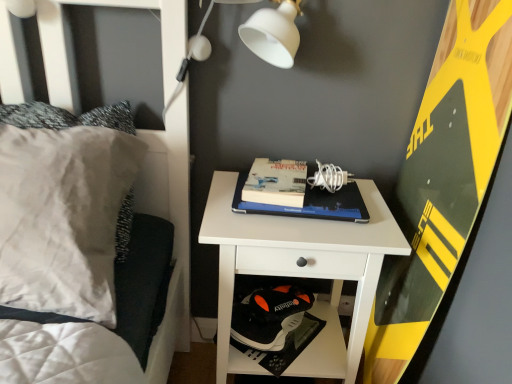
Question: Does hardcover book at center, which is counted as the 2th paperback book, starting from the left, come in front of yellow-green textured board at right?

Choices:
 (A) no
 (B) yes

Answer: (A)

Question: Does hardcover book at center, which is counted as the 2th paperback book, starting from the left, have a smaller size compared to yellow-green textured board at right?

Choices:
 (A) no
 (B) yes

Answer: (B)

Question: Can you confirm if hardcover book at center, which is counted as the 2th paperback book, starting from the left, is bigger than yellow-green textured board at right?

Choices:
 (A) yes
 (B) no

Answer: (B)

Question: From a real-world perspective, is hardcover book at center, which is counted as the 2th paperback book, starting from the left, below yellow-green textured board at right?

Choices:
 (A) yes
 (B) no

Answer: (B)

Question: Does hardcover book at center, which ranks as the 1th paperback book in right-to-left order, have a lesser height compared to yellow-green textured board at right?

Choices:
 (A) no
 (B) yes

Answer: (B)

Question: Based on their positions, is white matte lampshade at upper center located to the left or right of hardcover book at center, which is counted as the 2th paperback book, starting from the left?

Choices:
 (A) right
 (B) left

Answer: (B)

Question: Is white matte lampshade at upper center wider or thinner than hardcover book at center, which ranks as the 1th paperback book in right-to-left order?

Choices:
 (A) thin
 (B) wide

Answer: (A)

Question: Is white matte lampshade at upper center in front of or behind hardcover book at center, which is counted as the 2th paperback book, starting from the left, in the image?

Choices:
 (A) front
 (B) behind

Answer: (A)

Question: Is point (183, 77) positioned closer to the camera than point (309, 190)?

Choices:
 (A) farther
 (B) closer

Answer: (A)

Question: Based on their positions, is yellow-green textured board at right located to the left or right of hardcover book at center, which is the 1th paperback book from left to right?

Choices:
 (A) right
 (B) left

Answer: (A)

Question: Is yellow-green textured board at right inside the boundaries of hardcover book at center, which is the 1th paperback book from left to right, or outside?

Choices:
 (A) inside
 (B) outside

Answer: (B)

Question: From the image's perspective, is yellow-green textured board at right above or below hardcover book at center, the second paperback book when ordered from right to left?

Choices:
 (A) below
 (B) above

Answer: (A)

Question: Looking at their shapes, would you say yellow-green textured board at right is wider or thinner than hardcover book at center, which is the 1th paperback book from left to right?

Choices:
 (A) wide
 (B) thin

Answer: (B)

Question: Considering the positions of hardcover book at center, which ranks as the 1th paperback book in right-to-left order, and yellow-green textured board at right in the image, is hardcover book at center, which ranks as the 1th paperback book in right-to-left order, taller or shorter than yellow-green textured board at right?

Choices:
 (A) tall
 (B) short

Answer: (B)

Question: Is hardcover book at center, which is counted as the 2th paperback book, starting from the left, wider or thinner than yellow-green textured board at right?

Choices:
 (A) thin
 (B) wide

Answer: (B)